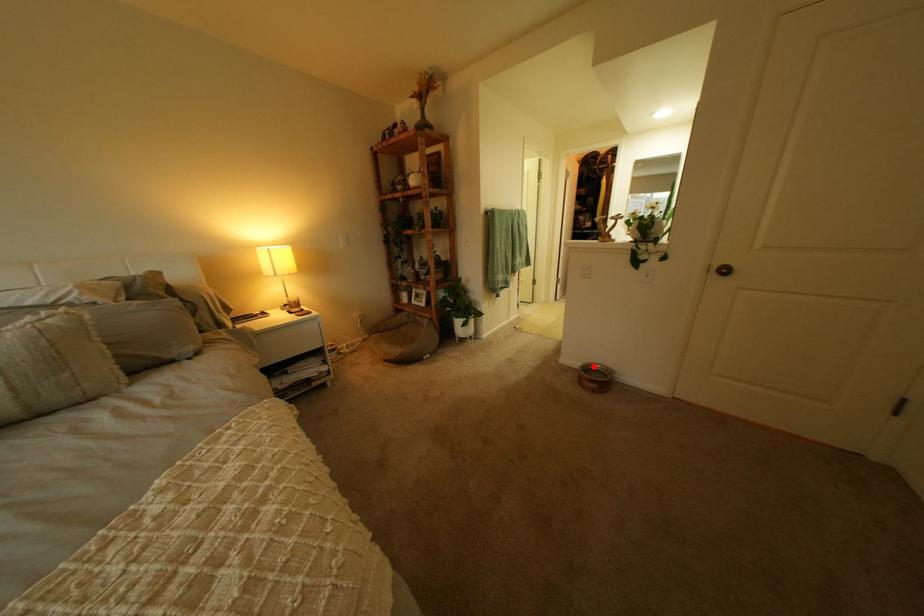
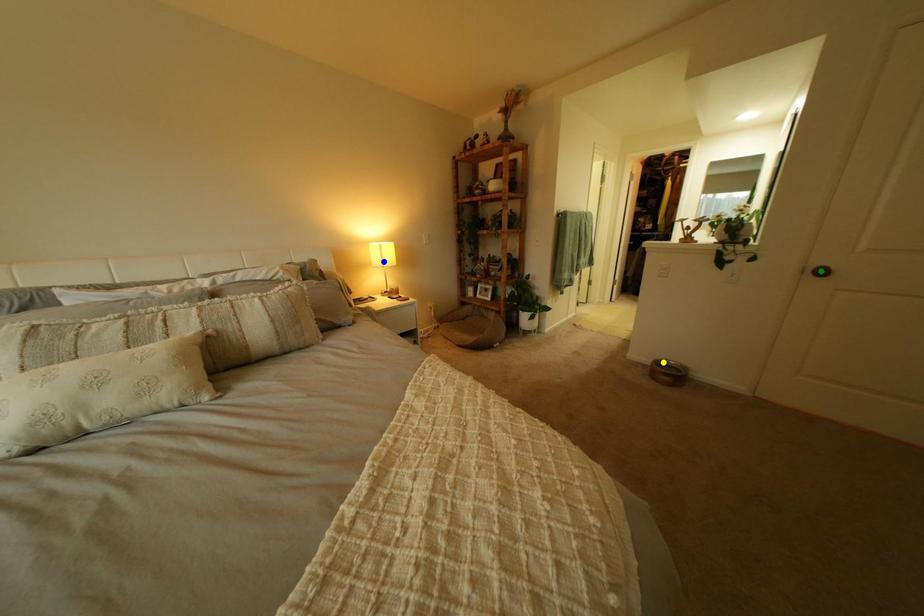
Question: I am providing you with two images of the same scene from different viewpoints. A red point is marked on the first image. You are given multiple points on the second image. Which mark in image 2 goes with the point in image 1?

Choices:
 (A) blue point
 (B) green point
 (C) yellow point

Answer: (C)